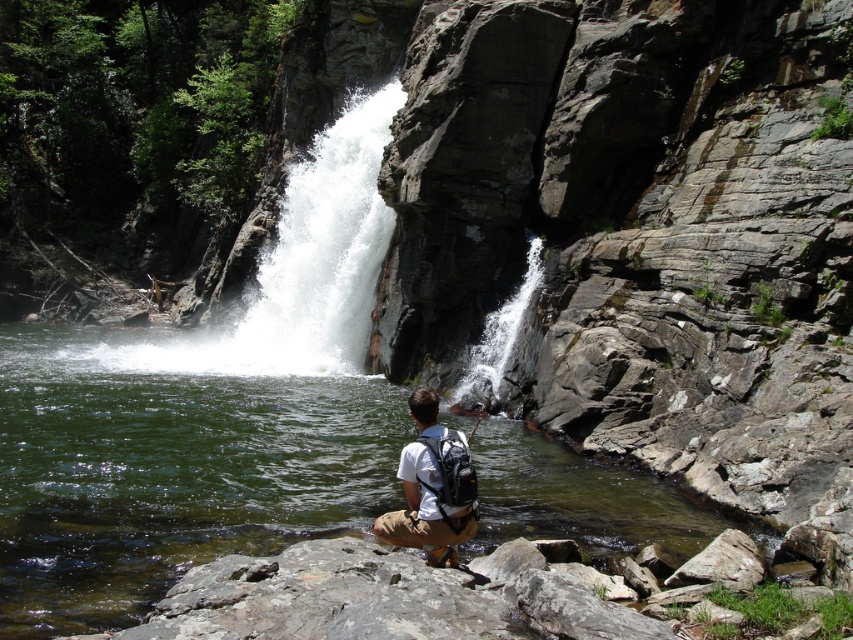
Can you confirm if white frothy water at center is thinner than white matte backpack at center?

Incorrect, white frothy water at center's width is not less than white matte backpack at center's.

Who is positioned more to the right, white frothy water at center or white matte backpack at center?

white matte backpack at center is more to the right.

Who is more forward, [180,371] or [450,433]?

Point [450,433] is more forward.

At what (x,y) coordinates should I click in order to perform the action: click on white frothy water at center. Please return your answer as a coordinate pair (x, y). Looking at the image, I should click on (300, 268).

Is clear water at center smaller than white frothy water at center?

Correct, clear water at center occupies less space than white frothy water at center.

Is clear water at center to the left of white frothy water at center from the viewer's perspective?

Incorrect, clear water at center is not on the left side of white frothy water at center.

Locate an element on the screen. clear water at center is located at coordinates (167, 465).

The image size is (853, 640). I want to click on clear water at center, so click(167, 465).

Between clear water at center and white matte backpack at center, which one is positioned higher?

clear water at center is higher up.

Who is more distant from viewer, (489, 545) or (473, 515)?

Positioned behind is point (489, 545).

In order to click on clear water at center in this screenshot , I will do `click(167, 465)`.